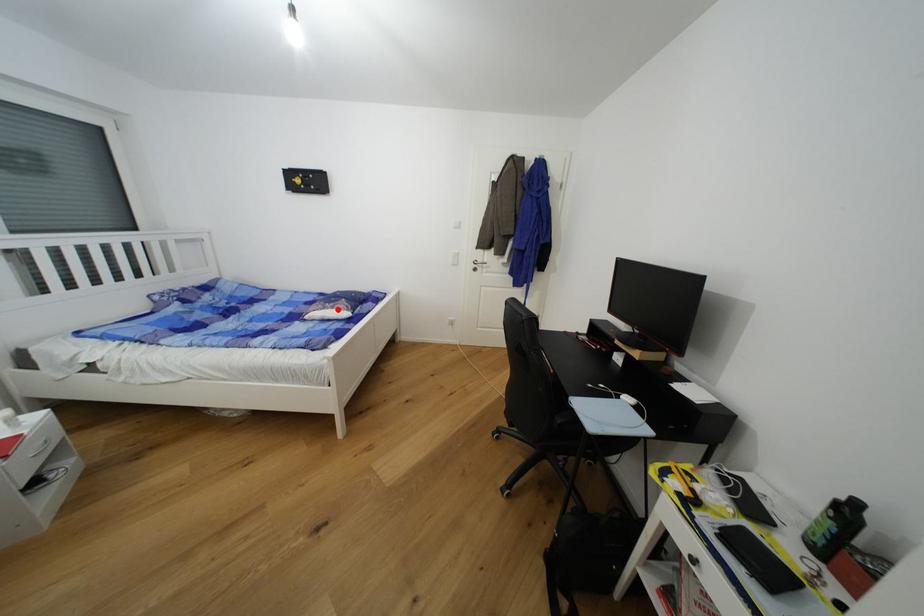
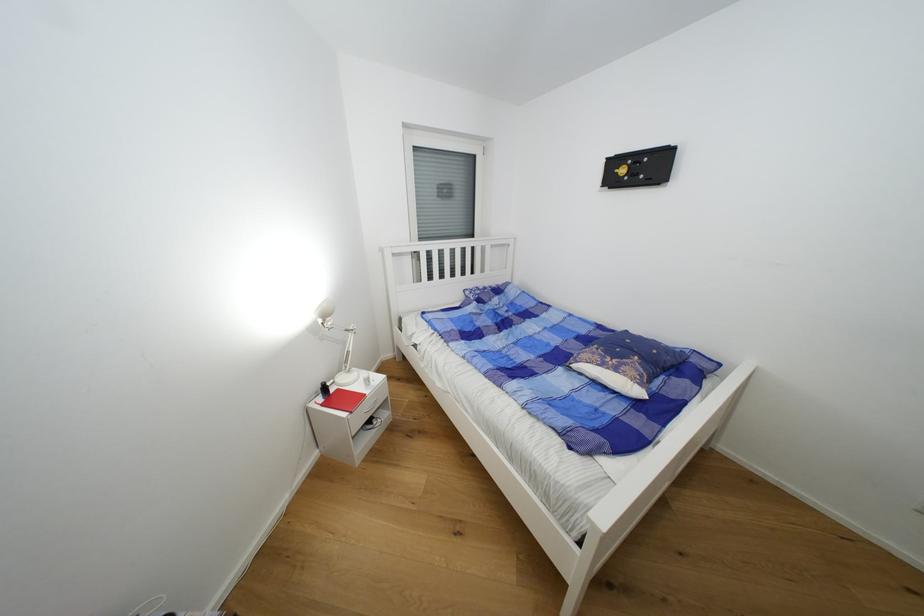
In the second image, find the point that corresponds to the highlighted location in the first image.

(622, 371)